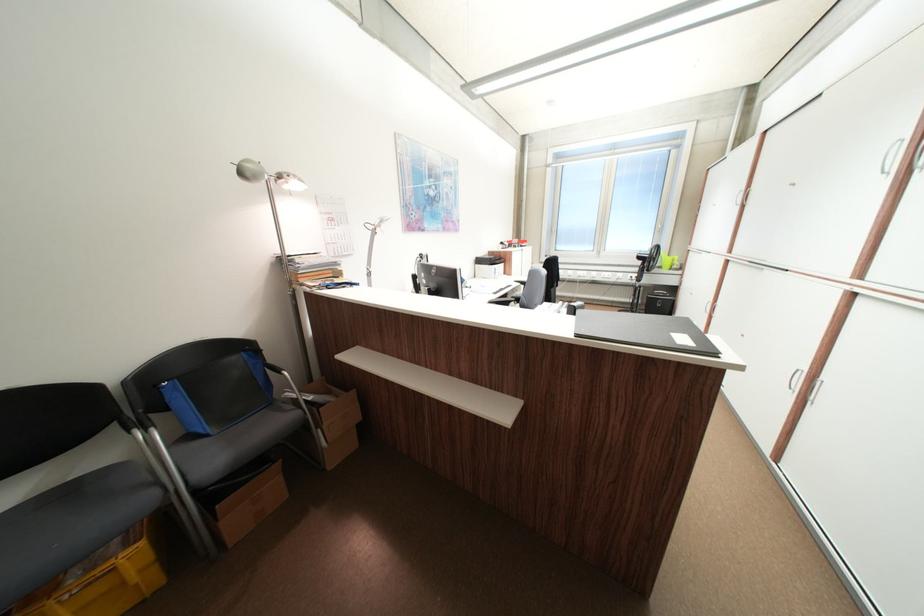
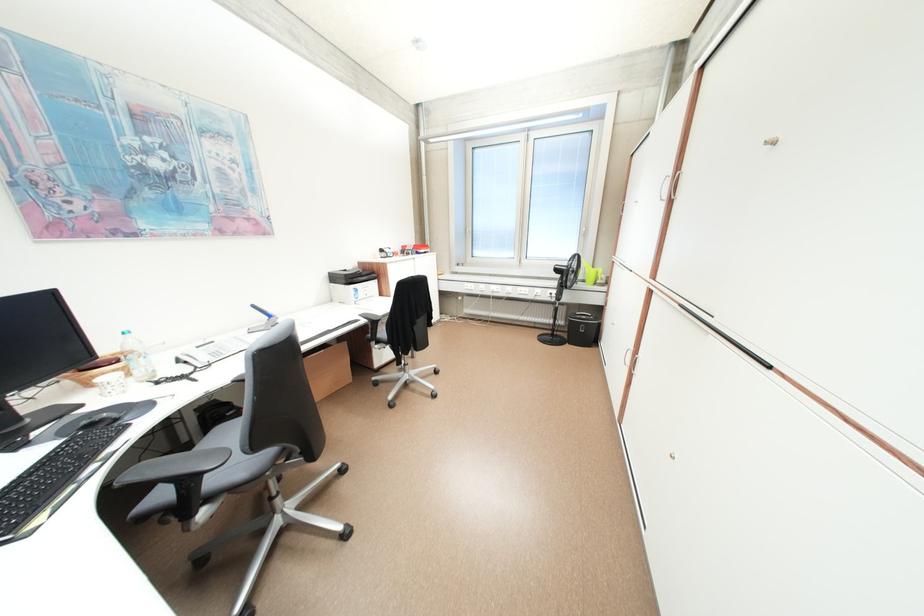
The point at (619,274) is marked in the first image. Where is the corresponding point in the second image?

(537, 290)